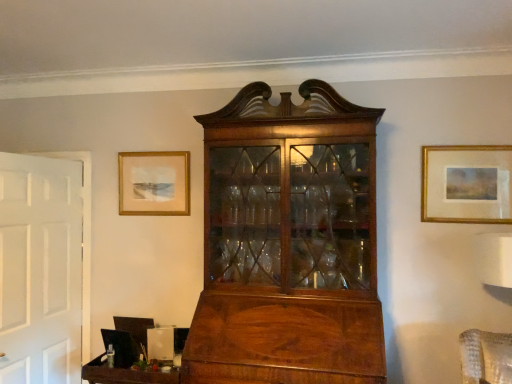
Question: From the image's perspective, is gold-framed painting at upper right, acting as the 1th picture frame starting from the right, above or below matte gold picture frame at upper left, the 1th picture frame positioned from the left?

Choices:
 (A) above
 (B) below

Answer: (B)

Question: Is gold-framed painting at upper right, which ranks as the 2th picture frame in back-to-front order, taller or shorter than matte gold picture frame at upper left, which ranks as the second picture frame in right-to-left order?

Choices:
 (A) tall
 (B) short

Answer: (A)

Question: Considering the real-world distances, which object is farthest from the gold-framed painting at upper right, which ranks as the 2th picture frame in back-to-front order?

Choices:
 (A) matte gold picture frame at upper left, which ranks as the second picture frame in right-to-left order
 (B) wooden tray at lower left

Answer: (B)

Question: Estimate the real-world distances between objects in this image. Which object is farther from the wooden tray at lower left?

Choices:
 (A) matte gold picture frame at upper left, which ranks as the second picture frame in right-to-left order
 (B) gold-framed painting at upper right, which ranks as the 2th picture frame in back-to-front order

Answer: (B)